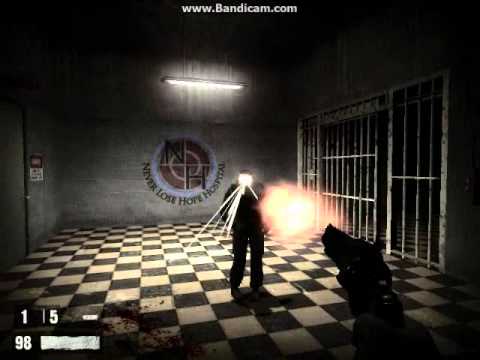
Where is `barred door`? Image resolution: width=480 pixels, height=360 pixels. barred door is located at coordinates (364, 155).